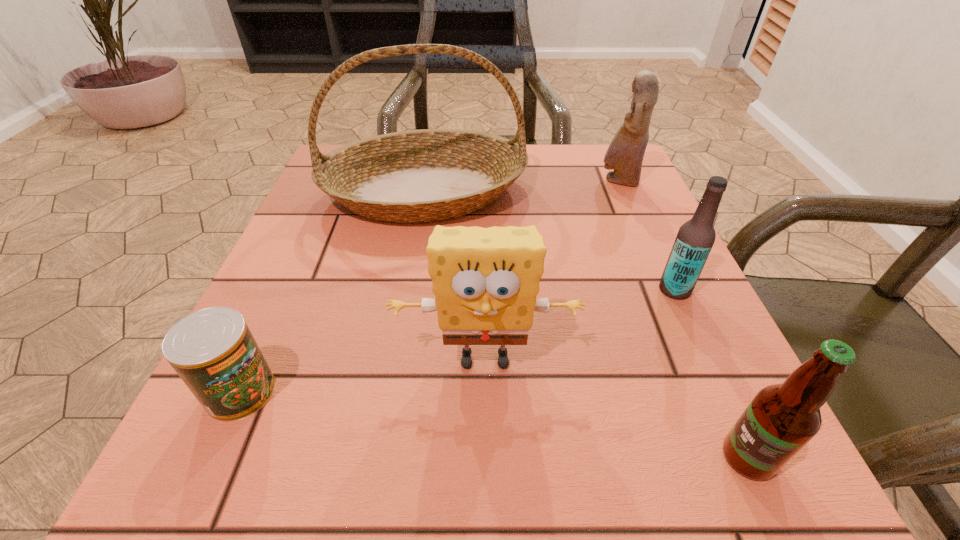
Where is `free space between the nearer beer bottle and the fourth nearest object`? This screenshot has width=960, height=540. free space between the nearer beer bottle and the fourth nearest object is located at coordinates (711, 374).

You are a GUI agent. You are given a task and a screenshot of the screen. Output one action in this format:
    pyautogui.click(x=<x>, y=<y>)
    Task: Click on the empty location between the fourth nearest object and the nearest object
    This screenshot has height=540, width=960.
    Given the screenshot: What is the action you would take?
    pyautogui.click(x=711, y=374)

This screenshot has width=960, height=540. What are the coordinates of `object that ranks as the second closest to the nearest object` in the screenshot? It's located at (695, 238).

Identify which object is located as the third nearest to the shortest object. Please provide its 2D coordinates. Your answer should be formatted as a tuple, i.e. [(x, y)], where the tuple contains the x and y coordinates of a point satisfying the conditions above.

[(782, 418)]

What are the coordinates of `free location that satisfies the following two spatial constraints: 1. on the front-facing side of the figurine; 2. on the face of the sponge` in the screenshot? It's located at (696, 358).